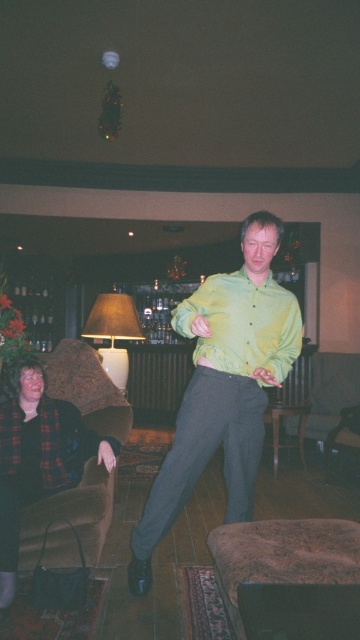
Which is below, green matte shirt at center or green shiny shirt at center?

green matte shirt at center is lower down.

Based on the photo, is green matte shirt at center above green shiny shirt at center?

No, green matte shirt at center is not above green shiny shirt at center.

This screenshot has width=360, height=640. I want to click on green matte shirt at center, so click(x=223, y=387).

Can you confirm if velvet brown couch at lower left is positioned to the right of green shiny shirt at center?

No, velvet brown couch at lower left is not to the right of green shiny shirt at center.

This screenshot has width=360, height=640. What do you see at coordinates (59, 456) in the screenshot? I see `velvet brown couch at lower left` at bounding box center [59, 456].

Is point (74, 449) positioned before point (245, 358)?

No.

Locate an element on the screen. The height and width of the screenshot is (640, 360). velvet brown couch at lower left is located at coordinates (59, 456).

Is green matte shirt at center thinner than velvet brown couch at lower left?

Incorrect, green matte shirt at center's width is not less than velvet brown couch at lower left's.

Can you confirm if green matte shirt at center is positioned to the right of velvet brown couch at lower left?

Indeed, green matte shirt at center is positioned on the right side of velvet brown couch at lower left.

Does point (232, 374) lie in front of point (61, 490)?

Yes.

Find the location of `green matte shirt at center`. green matte shirt at center is located at coordinates (223, 387).